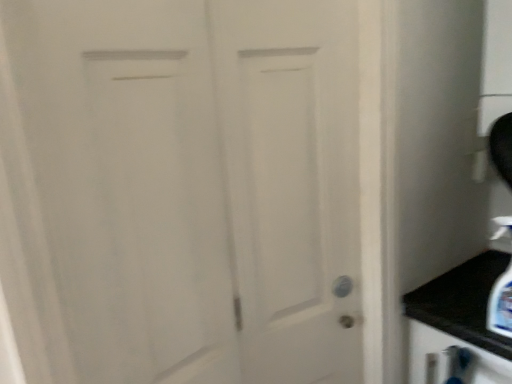
Describe the element at coordinates (501, 305) in the screenshot. I see `clear plastic soap dispenser at lower right` at that location.

Measure the distance between point (510, 287) and camera.

Point (510, 287) and camera are 1.06 meters apart from each other.

This screenshot has height=384, width=512. I want to click on clear plastic soap dispenser at lower right, so click(x=501, y=305).

Describe the element at coordinates (196, 185) in the screenshot. I see `white matte door at center` at that location.

Find the location of a particular element. white matte door at center is located at coordinates (196, 185).

This screenshot has height=384, width=512. What are the coordinates of `clear plastic soap dispenser at lower right` in the screenshot? It's located at (501, 305).

Is white matte door at center to the right of clear plastic soap dispenser at lower right from the viewer's perspective?

No.

Based on the photo, which is behind, white matte door at center or clear plastic soap dispenser at lower right?

clear plastic soap dispenser at lower right is further away from the camera.

Is point (226, 369) closer or farther from the camera than point (506, 297)?

Point (226, 369) is positioned closer to the camera compared to point (506, 297).

From the picture: From the image's perspective, is white matte door at center on top of clear plastic soap dispenser at lower right?

Yes, from the image's perspective, white matte door at center is above clear plastic soap dispenser at lower right.

From a real-world perspective, is white matte door at center positioned above or below clear plastic soap dispenser at lower right?

white matte door at center is situated higher than clear plastic soap dispenser at lower right in the real world.

Considering the sizes of white matte door at center and clear plastic soap dispenser at lower right in the image, is white matte door at center wider or thinner than clear plastic soap dispenser at lower right?

Clearly, white matte door at center has more width compared to clear plastic soap dispenser at lower right.

Is white matte door at center shorter than clear plastic soap dispenser at lower right?

No.

Is white matte door at center smaller than clear plastic soap dispenser at lower right?

Incorrect, white matte door at center is not smaller in size than clear plastic soap dispenser at lower right.

Can clear plastic soap dispenser at lower right be found inside white matte door at center?

No, clear plastic soap dispenser at lower right is not surrounded by white matte door at center.

Is white matte door at center positioned far away from clear plastic soap dispenser at lower right?

No, white matte door at center is not far away from clear plastic soap dispenser at lower right.

Is white matte door at center facing away from clear plastic soap dispenser at lower right?

white matte door at center is not turned away from clear plastic soap dispenser at lower right.

Measure the distance from white matte door at center to clear plastic soap dispenser at lower right.

They are 26.66 inches apart.

Image resolution: width=512 pixels, height=384 pixels. What are the coordinates of `door in front of the clear plastic soap dispenser at lower right` in the screenshot? It's located at (196, 185).

Which object is positioned more to the left, clear plastic soap dispenser at lower right or white matte door at center?

white matte door at center.

Does clear plastic soap dispenser at lower right lie in front of white matte door at center?

No.

Does point (498, 328) lie behind point (127, 142)?

Yes, it is behind point (127, 142).

From the image's perspective, is clear plastic soap dispenser at lower right located above or below white matte door at center?

From the image's perspective, clear plastic soap dispenser at lower right appears below white matte door at center.

From a real-world perspective, who is located higher, clear plastic soap dispenser at lower right or white matte door at center?

white matte door at center, from a real-world perspective.

Which of these two, clear plastic soap dispenser at lower right or white matte door at center, is thinner?

clear plastic soap dispenser at lower right.

Does clear plastic soap dispenser at lower right have a lesser height compared to white matte door at center?

Indeed, clear plastic soap dispenser at lower right has a lesser height compared to white matte door at center.

Considering the relative sizes of clear plastic soap dispenser at lower right and white matte door at center in the image provided, is clear plastic soap dispenser at lower right smaller than white matte door at center?

Correct, clear plastic soap dispenser at lower right occupies less space than white matte door at center.

Is clear plastic soap dispenser at lower right not within white matte door at center?

Absolutely, clear plastic soap dispenser at lower right is external to white matte door at center.

Is clear plastic soap dispenser at lower right placed right next to white matte door at center?

There is a gap between clear plastic soap dispenser at lower right and white matte door at center.

Consider the image. Is white matte door at center at the back of clear plastic soap dispenser at lower right?

That's not correct — clear plastic soap dispenser at lower right is not looking away from white matte door at center.

How different are the orientations of clear plastic soap dispenser at lower right and white matte door at center in degrees?

The angle between the facing direction of clear plastic soap dispenser at lower right and the facing direction of white matte door at center is 76.7 degrees.

How far apart are clear plastic soap dispenser at lower right and white matte door at center?

They are 67.72 centimeters apart.

Find the location of a particular element. door that is above the clear plastic soap dispenser at lower right (from a real-world perspective) is located at coordinates (196, 185).

Image resolution: width=512 pixels, height=384 pixels. What are the coordinates of `door above the clear plastic soap dispenser at lower right (from the image's perspective)` in the screenshot? It's located at (196, 185).

Where is `soap dispenser that is on the right side of white matte door at center`? The height and width of the screenshot is (384, 512). soap dispenser that is on the right side of white matte door at center is located at coordinates (501, 305).